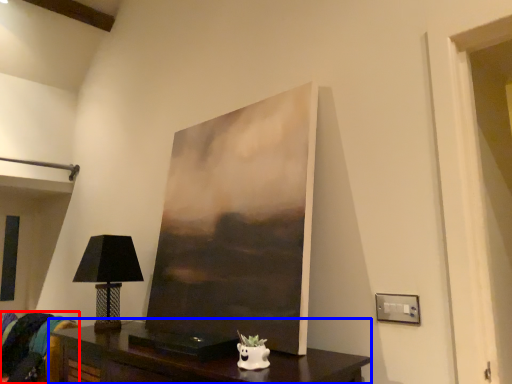
Question: Which object appears farthest to the camera in this image, swivel chair (highlighted by a red box) or table (highlighted by a blue box)?

Choices:
 (A) swivel chair
 (B) table

Answer: (A)